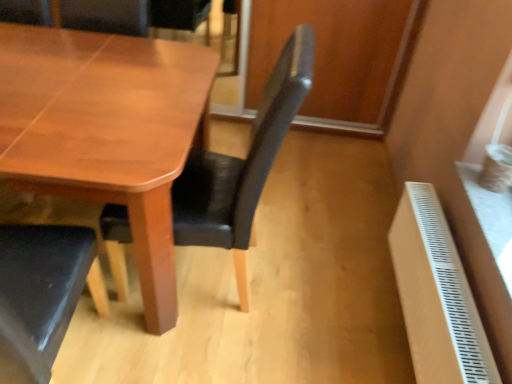
Identify the location of wooden table at center. The width and height of the screenshot is (512, 384). (106, 131).

What is the approximate width of white plastic radiator at lower right?

white plastic radiator at lower right is 12.69 centimeters in width.

The height and width of the screenshot is (384, 512). Find the location of `satin black chair at center`. satin black chair at center is located at coordinates (242, 165).

In the scene shown: In order to face satin black chair at center, should I rotate leftwards or rightwards?

Turn left by 6.957 degrees to look at satin black chair at center.

Locate an element on the screen. wooden table at center is located at coordinates (106, 131).

Which of these two, wooden table at center or white plastic radiator at lower right, is bigger?

wooden table at center.

Considering the points (162, 128) and (409, 284), which point is behind, point (162, 128) or point (409, 284)?

The point (409, 284) is farther from the camera.

Between wooden table at center and white plastic radiator at lower right, which one has less height?

white plastic radiator at lower right.

Can we say wooden table at center lies outside white plastic radiator at lower right?

Yes, wooden table at center is not within white plastic radiator at lower right.

From a real-world perspective, is satin black chair at center beneath white plastic radiator at lower right?

Incorrect, from a real-world perspective, satin black chair at center is higher than white plastic radiator at lower right.

Can you confirm if satin black chair at center is bigger than white plastic radiator at lower right?

Correct, satin black chair at center is larger in size than white plastic radiator at lower right.

Considering the relative positions of satin black chair at center and white plastic radiator at lower right in the image provided, is satin black chair at center in front of white plastic radiator at lower right?

Yes, satin black chair at center is in front of white plastic radiator at lower right.

Looking at this image, is satin black chair at center oriented away from white plastic radiator at lower right?

Yes, satin black chair at center is facing away from white plastic radiator at lower right.

Is white plastic radiator at lower right looking in the opposite direction of wooden table at center?

That's not correct — white plastic radiator at lower right is not looking away from wooden table at center.

At what (x,y) coordinates should I click in order to perform the action: click on radiator below the wooden table at center (from a real-world perspective). Please return your answer as a coordinate pair (x, y). This screenshot has height=384, width=512. Looking at the image, I should click on (436, 295).

Which point is more forward, (x=436, y=303) or (x=141, y=96)?

The point (x=436, y=303) is more forward.

This screenshot has width=512, height=384. I want to click on table on the left of satin black chair at center, so click(x=106, y=131).

From the image's perspective, is satin black chair at center on top of wooden table at center?

No.

Are satin black chair at center and wooden table at center far apart?

No.

Which of these two, satin black chair at center or wooden table at center, is wider?

wooden table at center.

Is white plastic radiator at lower right oriented away from satin black chair at center?

No, satin black chair at center is not at the back of white plastic radiator at lower right.

Would you say satin black chair at center is part of white plastic radiator at lower right's contents?

No.

From the image's perspective, between white plastic radiator at lower right and satin black chair at center, who is located below?

white plastic radiator at lower right appears lower in the image.

The height and width of the screenshot is (384, 512). What are the coordinates of `chair on the left side of white plastic radiator at lower right` in the screenshot? It's located at (242, 165).

Between wooden table at center and satin black chair at center, which one has smaller size?

With smaller size is satin black chair at center.

Considering the positions of points (167, 269) and (190, 162), is point (167, 269) closer to camera compared to point (190, 162)?

Yes, point (167, 269) is closer to viewer.

Based on the photo, considering the relative sizes of wooden table at center and satin black chair at center in the image provided, is wooden table at center shorter than satin black chair at center?

Yes, wooden table at center is shorter than satin black chair at center.

The image size is (512, 384). Identify the location of table lying behind the satin black chair at center. (106, 131).

Find the location of `table on the left side of white plastic radiator at lower right`. table on the left side of white plastic radiator at lower right is located at coordinates (106, 131).

This screenshot has height=384, width=512. Find the location of `chair in front of the white plastic radiator at lower right`. chair in front of the white plastic radiator at lower right is located at coordinates (242, 165).

From the image, which object appears to be farther from satin black chair at center, white plastic radiator at lower right or wooden table at center?

white plastic radiator at lower right.

Estimate the real-world distances between objects in this image. Which object is closer to wooden table at center, satin black chair at center or white plastic radiator at lower right?

satin black chair at center lies closer to wooden table at center than the other object.

Looking at the image, which one is located further to satin black chair at center, wooden table at center or white plastic radiator at lower right?

white plastic radiator at lower right is positioned further to the anchor satin black chair at center.

Based on their spatial positions, is white plastic radiator at lower right or satin black chair at center further from wooden table at center?

white plastic radiator at lower right.

From the image, which object appears to be farther from white plastic radiator at lower right, wooden table at center or satin black chair at center?

wooden table at center lies further to white plastic radiator at lower right than the other object.

Considering their positions, is satin black chair at center positioned closer to white plastic radiator at lower right than wooden table at center?

Among the two, satin black chair at center is located nearer to white plastic radiator at lower right.

Where is `chair located between wooden table at center and white plastic radiator at lower right in the left-right direction`? Image resolution: width=512 pixels, height=384 pixels. chair located between wooden table at center and white plastic radiator at lower right in the left-right direction is located at coordinates (242, 165).